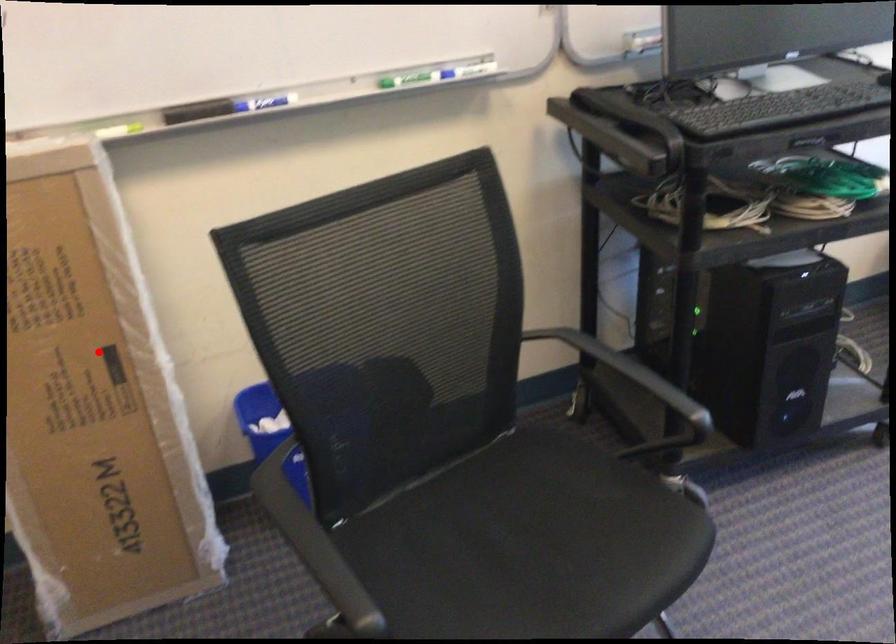
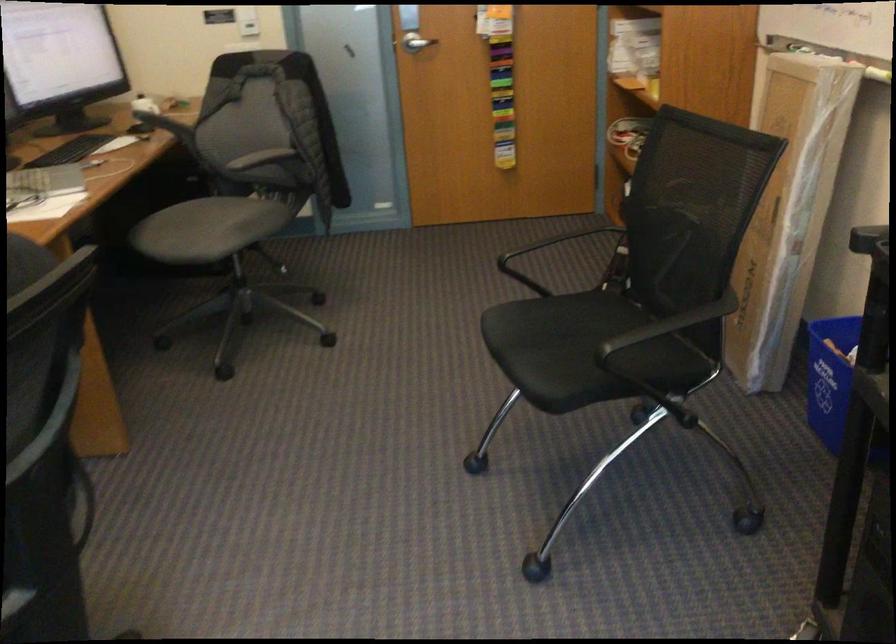
Question: I am providing you with two images of the same scene from different viewpoints. Given a red point in image1, look at the same physical point in image2. Is it:

Choices:
 (A) Closer to the viewpoint
 (B) Farther from the viewpoint

Answer: (B)